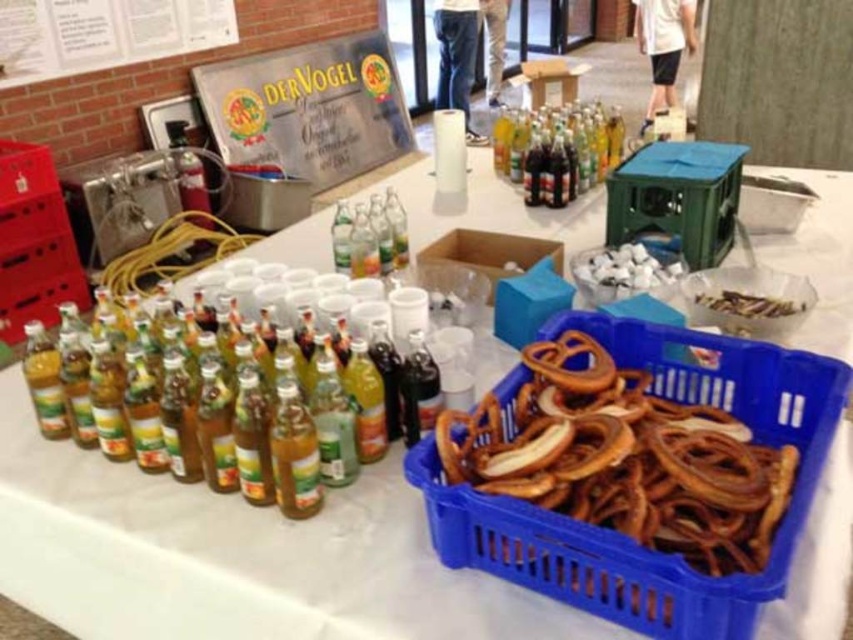
You are organizing a party and need to place a decorative plate behind the dark glass bottle at center so it can be seen through the bottle. Can the plate be placed behind the white matte pretzel at center without blocking the view?

The dark glass bottle at center is in front of the white matte pretzel at center, so placing the decorative plate behind the white matte pretzel at center would position it behind both objects. This means the plate would be blocked by the dark glass bottle at center, making it invisible through the bottle. To ensure the plate is visible, it should be placed directly behind the dark glass bottle at center without any obstruction.

You are organizing a party and need to place a new item between the blue plastic basket at lower right and the dark glass bottle at center. Based on their positions, where should you place the new item to ensure it is between them?

The blue plastic basket at lower right is located below the dark glass bottle at center, so placing the new item between them would require positioning it above the blue plastic basket at lower right and below the dark glass bottle at center.